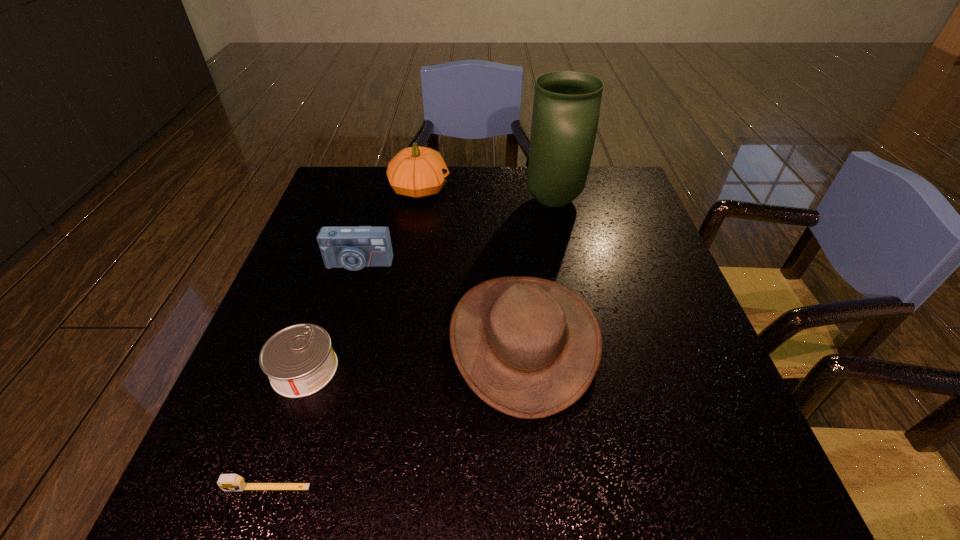
You are a GUI agent. You are given a task and a screenshot of the screen. Output one action in this format:
    pyautogui.click(x=<x>, y=<y>)
    Task: Click on the free space at the far left corner
    Image resolution: width=960 pixels, height=540 pixels.
    Given the screenshot: What is the action you would take?
    [348, 197]

This screenshot has width=960, height=540. I want to click on vacant space that is in between the second tallest object and the can, so click(x=362, y=279).

Find the location of a particular element. This screenshot has height=540, width=960. free spot between the gourd and the tallest object is located at coordinates (487, 195).

This screenshot has height=540, width=960. I want to click on empty space between the cowboy hat and the tallest object, so click(539, 270).

Locate an element on the screen. This screenshot has width=960, height=540. vacant area that lies between the tallest object and the fifth shortest object is located at coordinates (487, 195).

Where is `vacant point located between the fifth tallest object and the third farthest object`? vacant point located between the fifth tallest object and the third farthest object is located at coordinates (331, 316).

At what (x,y) coordinates should I click in order to perform the action: click on free space between the cowboy hat and the can. Please return your answer as a coordinate pair (x, y). Looking at the image, I should click on [x=414, y=354].

Identify the location of free space between the tallest object and the fifth tallest object. This screenshot has width=960, height=540. (429, 285).

You are a GUI agent. You are given a task and a screenshot of the screen. Output one action in this format:
    pyautogui.click(x=<x>, y=<y>)
    Task: Click on the vacant space in between the vase and the nearest object
    This screenshot has height=540, width=960.
    Given the screenshot: What is the action you would take?
    pyautogui.click(x=411, y=344)

This screenshot has height=540, width=960. I want to click on free spot between the fifth tallest object and the shortest object, so click(x=286, y=428).